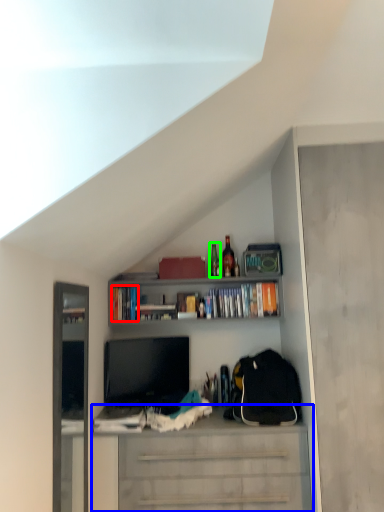
Question: Estimate the real-world distances between objects in this image. Which object is closer to book (highlighted by a red box), cabinetry (highlighted by a blue box) or bottle (highlighted by a green box)?

Choices:
 (A) cabinetry
 (B) bottle

Answer: (B)